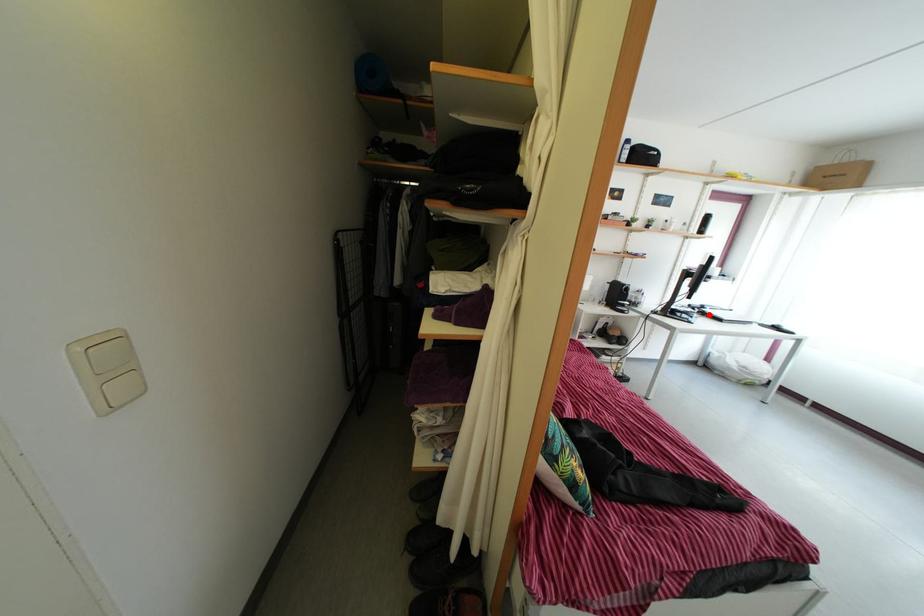
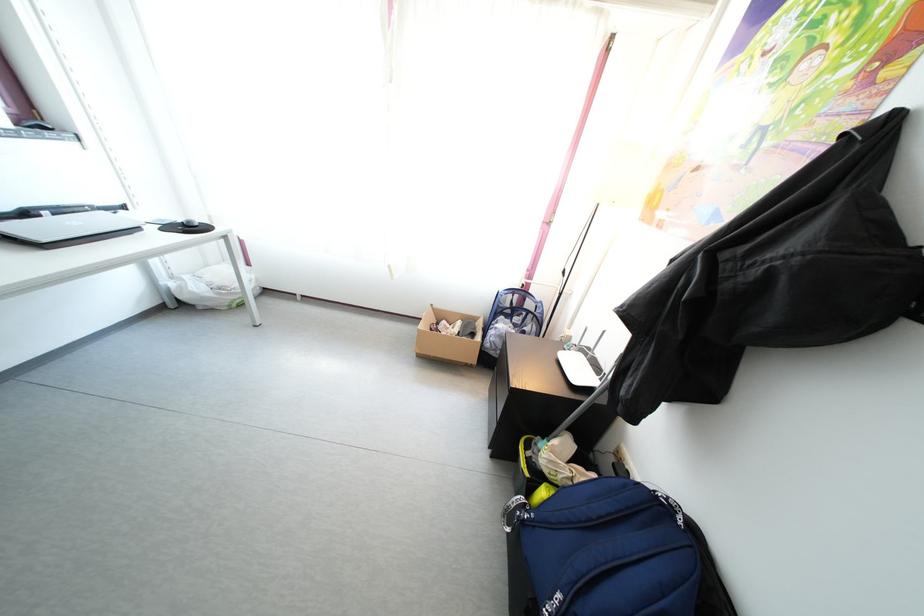
Question: I am providing you with two images of the same scene from different viewpoints. A red point is marked on the first image. Is the red point's position out of view in image 2?

Choices:
 (A) Yes
 (B) No

Answer: (B)